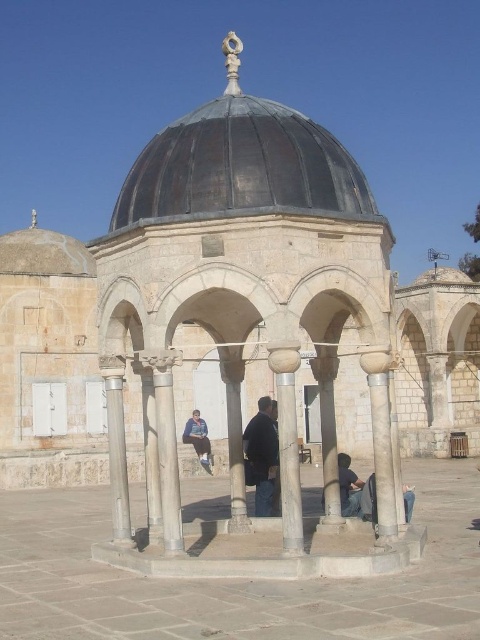
Question: Is gray stone column at center further to camera compared to dark blue jeans at center?

Choices:
 (A) yes
 (B) no

Answer: (B)

Question: Which is nearer to the dark blue jeans at center?

Choices:
 (A) black matte jacket at center
 (B) rusty metal dome at center
 (C) blue denim jeans at center
 (D) gray stone column at center

Answer: (A)

Question: Which object appears closest to the camera in this image?

Choices:
 (A) rusty metal dome at center
 (B) gray stone column at center

Answer: (A)

Question: Is gray stone column at center smaller than blue denim jeans at center?

Choices:
 (A) no
 (B) yes

Answer: (A)

Question: Is gray stone column at center positioned before black matte jacket at center?

Choices:
 (A) no
 (B) yes

Answer: (B)

Question: Which point is closer to the camera?

Choices:
 (A) (200, 436)
 (B) (110, 442)
 (C) (360, 492)
 (D) (186, 182)

Answer: (D)